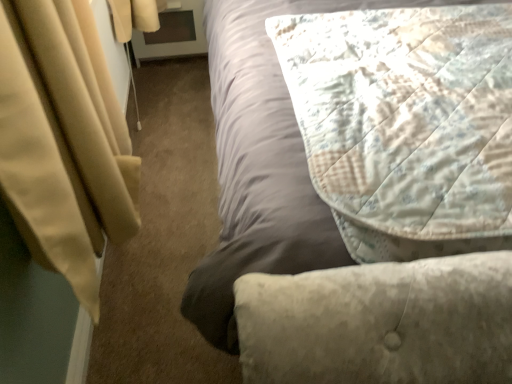
Question: From the image's perspective, is quilted fabric bed at center above or below quilted fabric pillow at upper right?

Choices:
 (A) above
 (B) below

Answer: (A)

Question: Considering the positions of point (224, 276) and point (373, 170), is point (224, 276) closer or farther from the camera than point (373, 170)?

Choices:
 (A) farther
 (B) closer

Answer: (A)

Question: From a real-world perspective, is quilted fabric bed at center positioned above or below quilted fabric pillow at upper right?

Choices:
 (A) below
 (B) above

Answer: (A)

Question: In terms of width, does quilted fabric pillow at upper right look wider or thinner when compared to quilted fabric bed at center?

Choices:
 (A) thin
 (B) wide

Answer: (A)

Question: Is quilted fabric pillow at upper right taller or shorter than quilted fabric bed at center?

Choices:
 (A) short
 (B) tall

Answer: (A)

Question: Is quilted fabric pillow at upper right in front of or behind quilted fabric bed at center in the image?

Choices:
 (A) front
 (B) behind

Answer: (B)

Question: Does point (422, 74) appear closer or farther from the camera than point (224, 52)?

Choices:
 (A) farther
 (B) closer

Answer: (B)